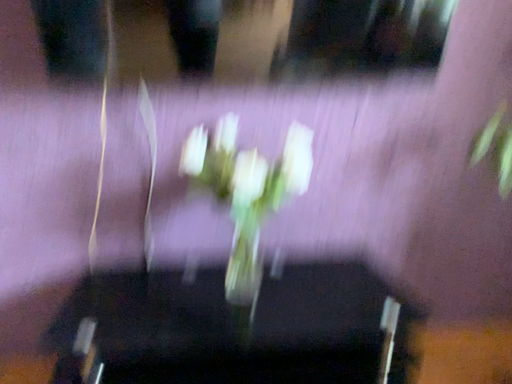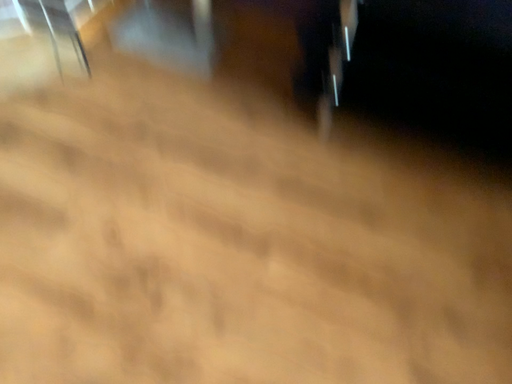
Question: How did the camera likely rotate when shooting the video?

Choices:
 (A) rotated downward
 (B) rotated upward

Answer: (A)